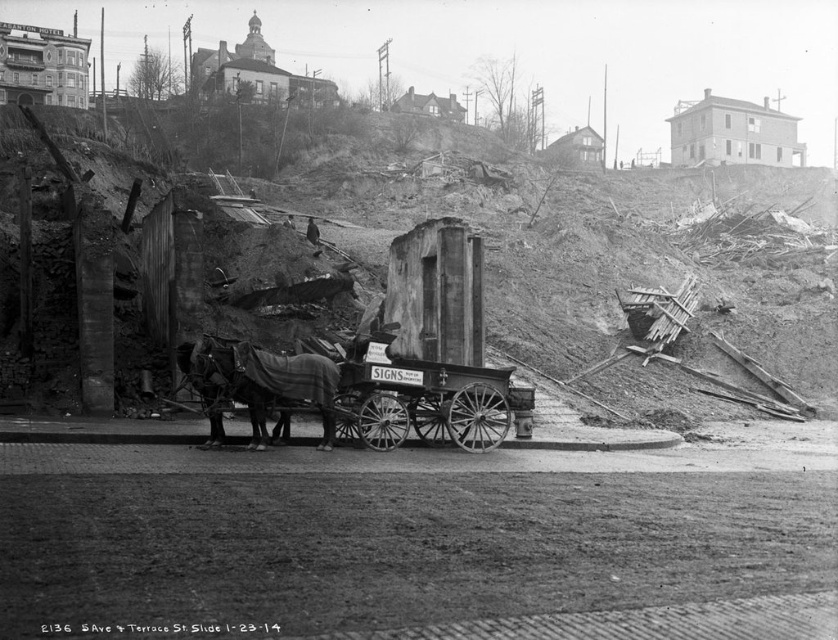
Between point (427, 420) and point (280, 380), which one is positioned in front?

Point (280, 380) is in front.

At what (x,y) coordinates should I click in order to perform the action: click on wooden cart at center. Please return your answer as a coordinate pair (x, y). The height and width of the screenshot is (640, 838). Looking at the image, I should click on click(x=350, y=394).